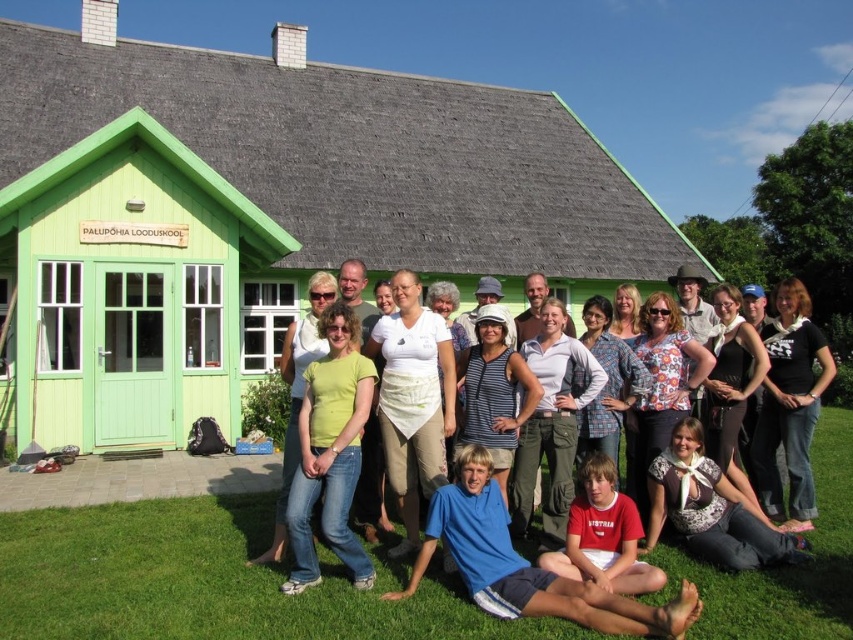
Question: Does green wooden hut at center have a larger size compared to white cotton shirt at center?

Choices:
 (A) yes
 (B) no

Answer: (A)

Question: Based on their relative distances, which object is nearer to the white cotton shirt at center?

Choices:
 (A) blue cotton shirt at lower center
 (B) green wooden hut at center
 (C) green grass at lower center
 (D) red cotton shirt at lower center

Answer: (C)

Question: Where is green grass at lower center located in relation to white cotton shirt at center in the image?

Choices:
 (A) below
 (B) above

Answer: (A)

Question: Which of the following is the closest to the observer?

Choices:
 (A) (378, 620)
 (B) (120, 525)
 (C) (538, 237)
 (D) (592, 620)

Answer: (D)

Question: Can you confirm if green grass at lower center is positioned to the right of red cotton shirt at lower center?

Choices:
 (A) no
 (B) yes

Answer: (A)

Question: Which object is closer to the camera taking this photo?

Choices:
 (A) red cotton shirt at lower center
 (B) blue cotton shirt at lower center

Answer: (B)